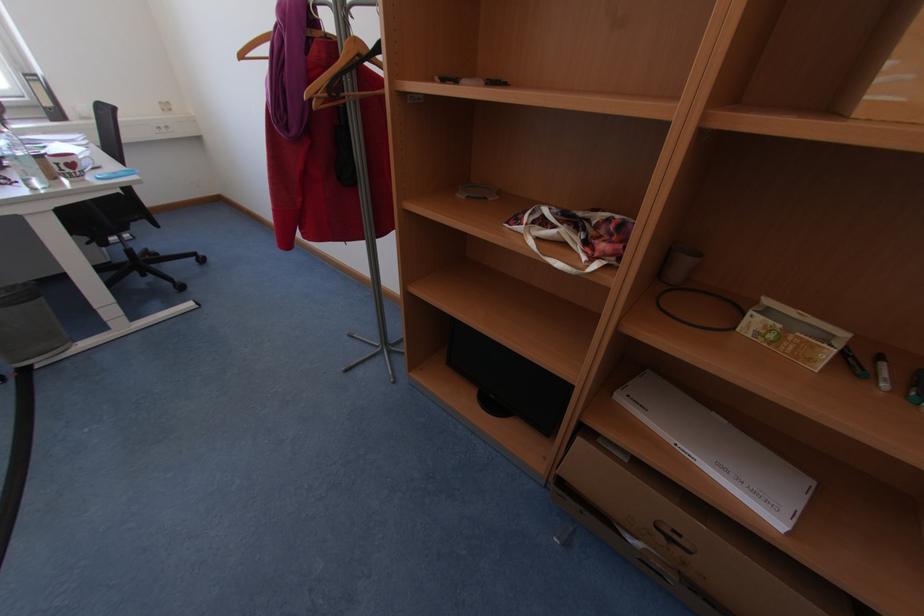
Where is `green cap marker`? Image resolution: width=924 pixels, height=616 pixels. green cap marker is located at coordinates (916, 387).